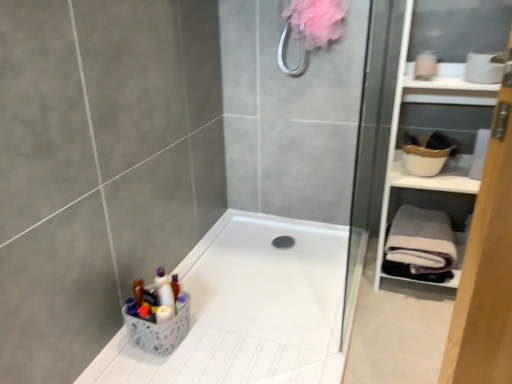
Question: Does white plastic basket at lower left have a lesser width compared to white matte cabinet at right?

Choices:
 (A) no
 (B) yes

Answer: (B)

Question: Can you confirm if white plastic basket at lower left is smaller than white matte cabinet at right?

Choices:
 (A) yes
 (B) no

Answer: (A)

Question: Would you say white plastic basket at lower left is outside white matte cabinet at right?

Choices:
 (A) yes
 (B) no

Answer: (A)

Question: Is white plastic basket at lower left behind white matte cabinet at right?

Choices:
 (A) yes
 (B) no

Answer: (A)

Question: Considering the relative sizes of white plastic basket at lower left and white matte cabinet at right in the image provided, is white plastic basket at lower left bigger than white matte cabinet at right?

Choices:
 (A) yes
 (B) no

Answer: (B)

Question: Is the surface of white plastic basket at lower left in direct contact with white matte cabinet at right?

Choices:
 (A) no
 (B) yes

Answer: (A)

Question: Is gray fleece bath towel at right completely or partially outside of white plastic basket at lower left?

Choices:
 (A) yes
 (B) no

Answer: (A)

Question: Could you tell me if gray fleece bath towel at right is turned towards white plastic basket at lower left?

Choices:
 (A) no
 (B) yes

Answer: (A)

Question: Is gray fleece bath towel at right to the left of white plastic basket at lower left from the viewer's perspective?

Choices:
 (A) yes
 (B) no

Answer: (B)

Question: From a real-world perspective, does gray fleece bath towel at right sit lower than white plastic basket at lower left?

Choices:
 (A) yes
 (B) no

Answer: (B)

Question: Is gray fleece bath towel at right positioned far away from white plastic basket at lower left?

Choices:
 (A) yes
 (B) no

Answer: (B)

Question: Is white plastic basket at lower left inside gray fleece bath towel at right?

Choices:
 (A) no
 (B) yes

Answer: (A)

Question: Does white matte cabinet at right turn towards white plastic basket at lower left?

Choices:
 (A) yes
 (B) no

Answer: (B)